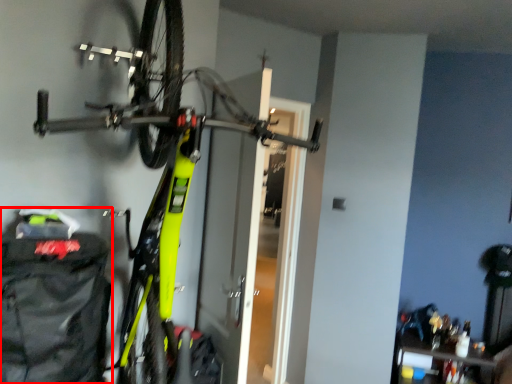
Question: From the image's perspective, where is backpack (annotated by the red box) located relative to bicycle?

Choices:
 (A) below
 (B) above

Answer: (A)